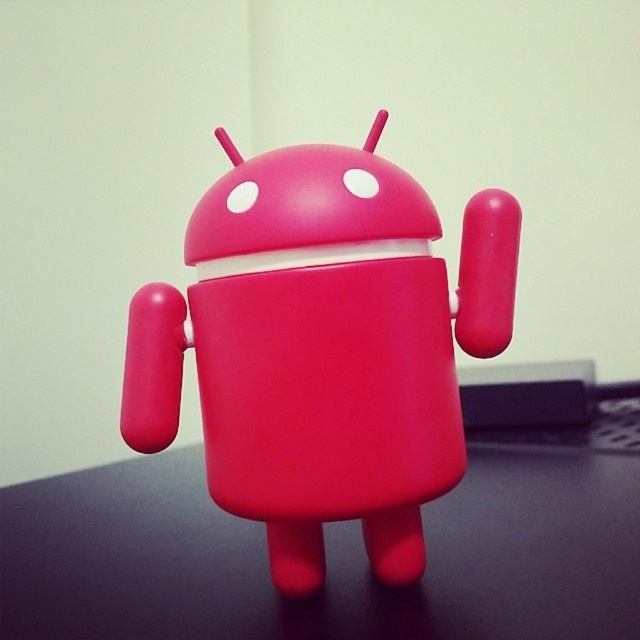
Based on the photo, you are a toy collector who wants to place a new Android figurine on your desk. The desk has a dark surface. You have a point marked at coordinates (323, 348). Where should you place the Android figurine to match the scene?

The point at coordinates (323, 348) indicates where the matte plastic Android at center should be placed.